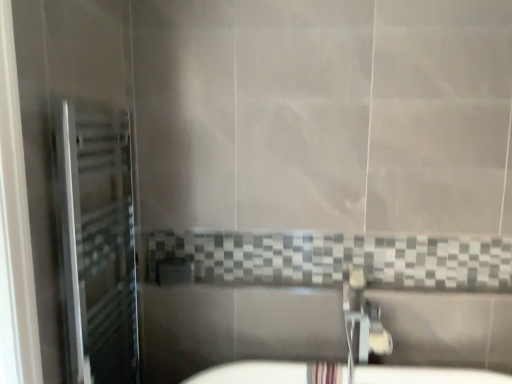
Question: In the image, is silver metallic towel rack at left on the left side or the right side of metallic chrome faucet at lower center?

Choices:
 (A) left
 (B) right

Answer: (A)

Question: Is silver metallic towel rack at left spatially inside metallic chrome faucet at lower center, or outside of it?

Choices:
 (A) outside
 (B) inside

Answer: (A)

Question: Considering the positions of point (68, 347) and point (350, 299), is point (68, 347) closer or farther from the camera than point (350, 299)?

Choices:
 (A) closer
 (B) farther

Answer: (A)

Question: From a real-world perspective, is metallic chrome faucet at lower center physically located above or below silver metallic towel rack at left?

Choices:
 (A) above
 (B) below

Answer: (B)

Question: Is metallic chrome faucet at lower center inside or outside of silver metallic towel rack at left?

Choices:
 (A) outside
 (B) inside

Answer: (A)

Question: Considering the positions of metallic chrome faucet at lower center and silver metallic towel rack at left in the image, is metallic chrome faucet at lower center bigger or smaller than silver metallic towel rack at left?

Choices:
 (A) small
 (B) big

Answer: (A)

Question: From their relative heights in the image, would you say metallic chrome faucet at lower center is taller or shorter than silver metallic towel rack at left?

Choices:
 (A) tall
 (B) short

Answer: (B)